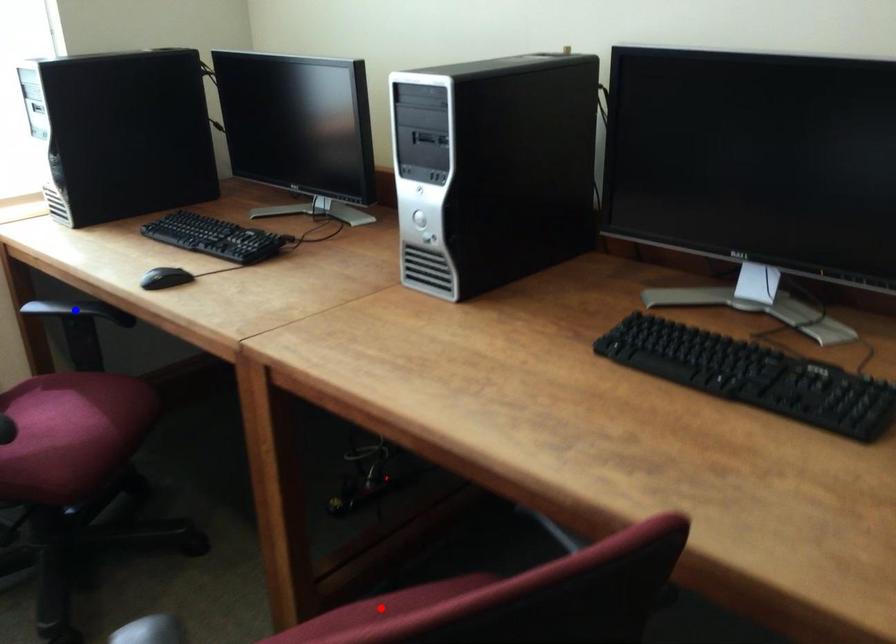
Question: In the image, two points are highlighted. Which point is nearer to the camera? Reply with the corresponding letter.

Choices:
 (A) blue point
 (B) red point

Answer: (B)